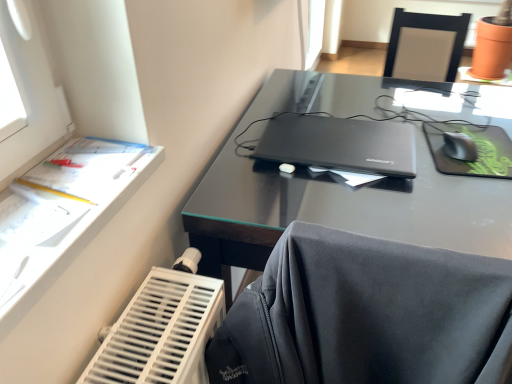
Where is `vacant space situated on the left part of matte black laptop at center`? The width and height of the screenshot is (512, 384). vacant space situated on the left part of matte black laptop at center is located at coordinates (243, 157).